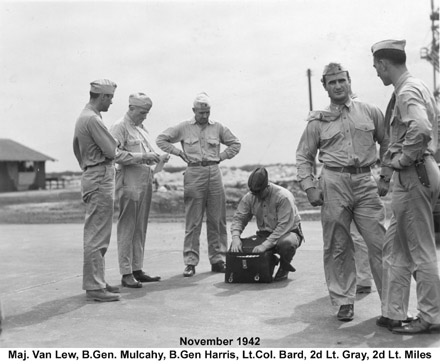
At what (x,y) coordinates should I click in order to perform the action: click on window. Please return your answer as a coordinate pair (x, y). Image resolution: width=440 pixels, height=364 pixels. Looking at the image, I should click on (27, 167).